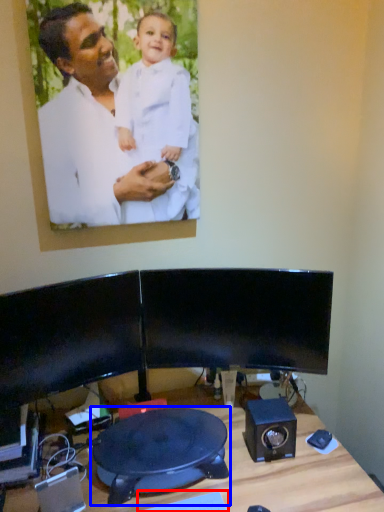
Question: Which object is closer to the camera taking this photo, keyboard (highlighted by a red box) or swivel chair (highlighted by a blue box)?

Choices:
 (A) keyboard
 (B) swivel chair

Answer: (A)